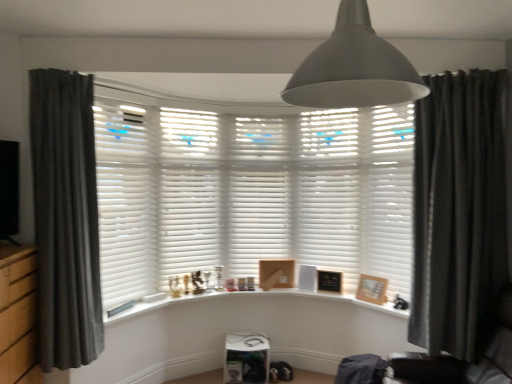
Locate an element on the screen. free spot in front of black matte picture frame at center, which is counted as the second picture frame, starting from the back is located at coordinates (339, 294).